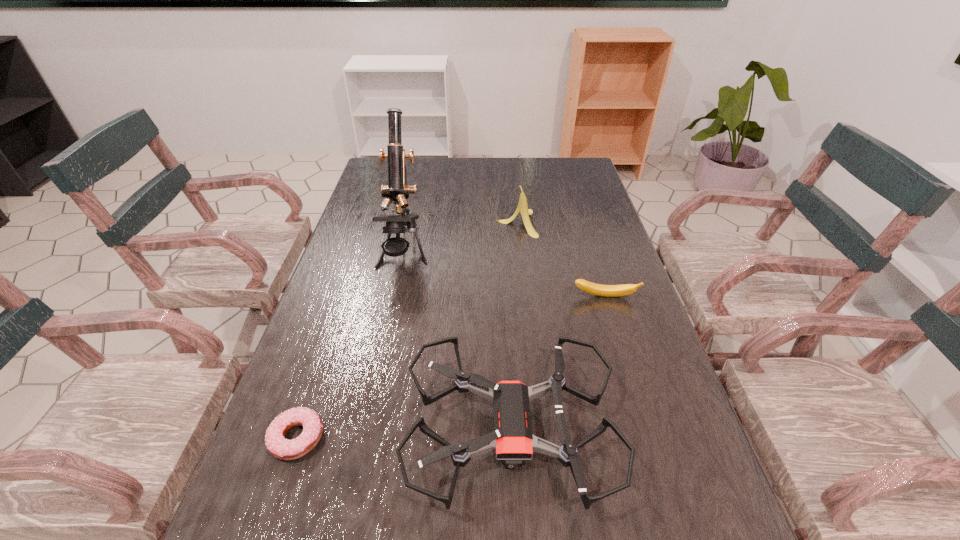
Locate an element on the screen. Image resolution: width=960 pixels, height=540 pixels. vacant region at the far edge of the desktop is located at coordinates (487, 184).

Find the location of a particular element. The image size is (960, 540). vacant space at the left edge of the desktop is located at coordinates tap(323, 488).

Where is `vacant region at the right edge`? vacant region at the right edge is located at coordinates (693, 514).

Locate an element on the screen. vacant space at the far left corner of the desktop is located at coordinates (372, 181).

The width and height of the screenshot is (960, 540). Find the location of `free location at the far right corner`. free location at the far right corner is located at coordinates (569, 162).

At what (x,y) coordinates should I click in order to perform the action: click on free space between the doughnut and the second tallest object. Please return your answer as a coordinate pair (x, y). Looking at the image, I should click on [407, 330].

You are a GUI agent. You are given a task and a screenshot of the screen. Output one action in this format:
    pyautogui.click(x=<x>, y=<y>)
    Task: Click on the free space between the second tallest object and the tallest object
    This screenshot has height=540, width=960.
    Given the screenshot: What is the action you would take?
    pyautogui.click(x=460, y=238)

At what (x,y) coordinates should I click in order to perform the action: click on vacant point located between the fourth shortest object and the tallest object. Please return your answer as a coordinate pair (x, y). The height and width of the screenshot is (540, 960). Looking at the image, I should click on (460, 238).

In order to click on free space between the doughnut and the tallest object in this screenshot , I will do `click(350, 345)`.

Identify the location of vacant point located between the fourth tallest object and the doughnut. (451, 367).